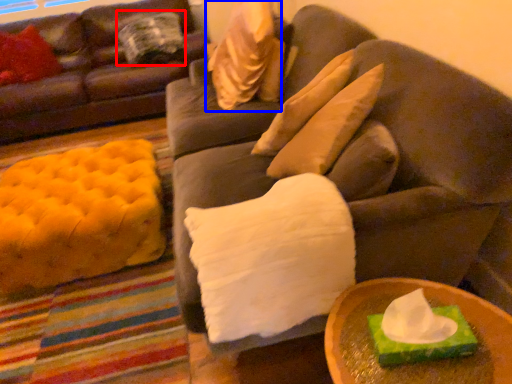
Question: Among these objects, which one is nearest to the camera, pillow (highlighted by a red box) or pillow (highlighted by a blue box)?

Choices:
 (A) pillow
 (B) pillow

Answer: (B)